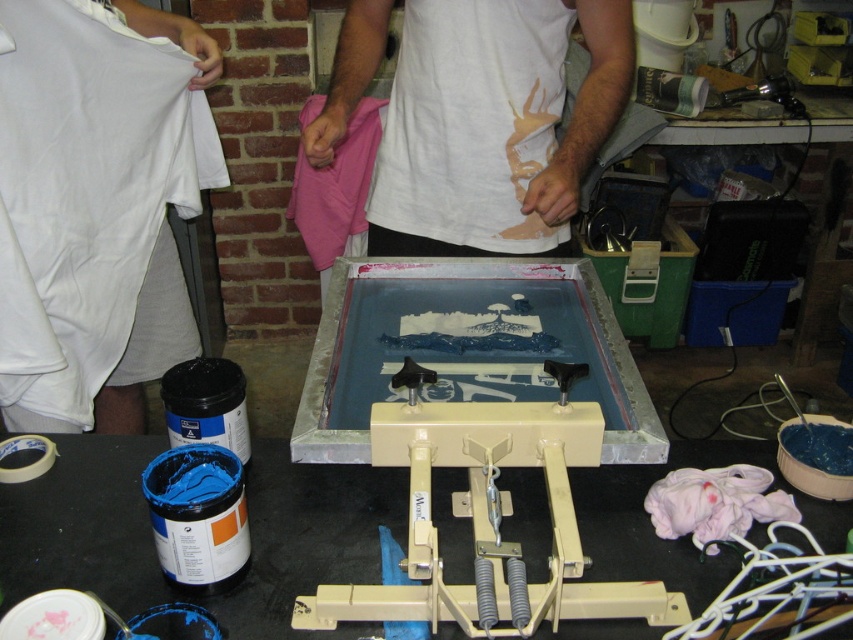
Question: Is white cotton t-shirt at left positioned at the back of black plastic table at center?

Choices:
 (A) no
 (B) yes

Answer: (B)

Question: Which point is farther from the camera taking this photo?

Choices:
 (A) (184, 77)
 (B) (416, 93)
 (C) (100, 573)

Answer: (B)

Question: Can you confirm if white cotton t-shirt at left is bigger than white cotton shirt at center?

Choices:
 (A) yes
 (B) no

Answer: (A)

Question: Estimate the real-world distances between objects in this image. Which object is closer to the white cotton shirt at center?

Choices:
 (A) black plastic table at center
 (B) white cotton t-shirt at left

Answer: (B)

Question: Which object appears farthest from the camera in this image?

Choices:
 (A) white cotton t-shirt at left
 (B) black plastic table at center
 (C) white cotton shirt at center

Answer: (C)

Question: Is white cotton t-shirt at left in front of white cotton shirt at center?

Choices:
 (A) yes
 (B) no

Answer: (A)